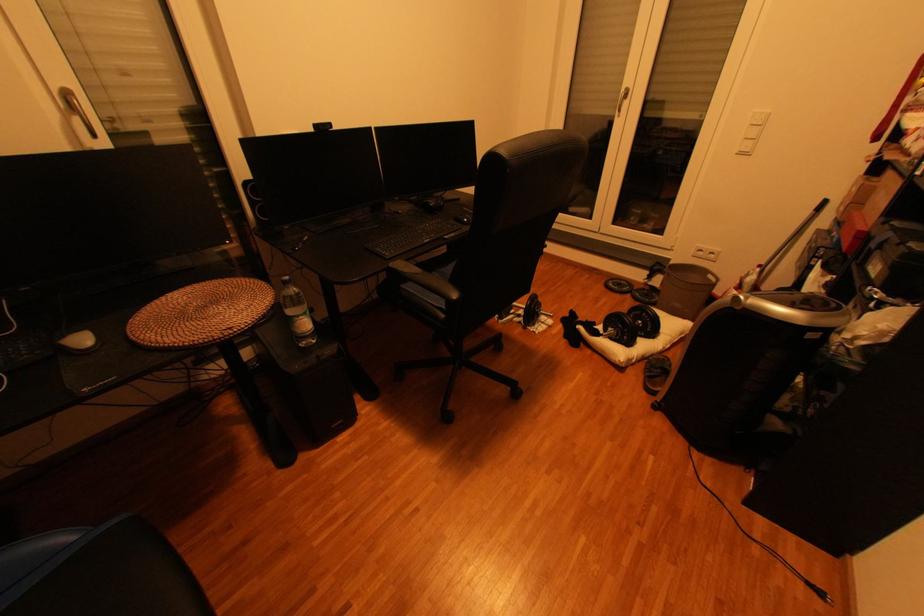
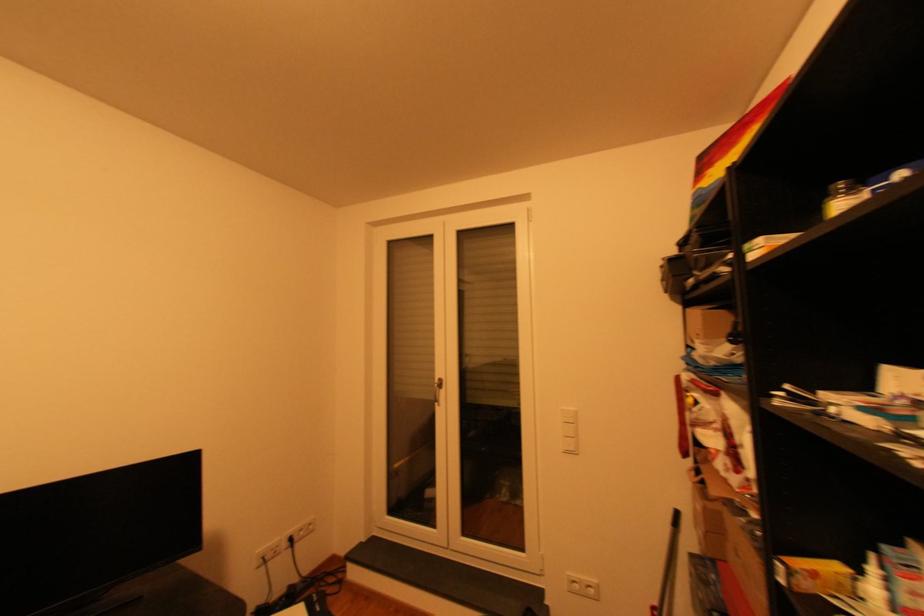
In the second image, find the point that corresponds to (x=771, y=267) in the first image.

(662, 608)